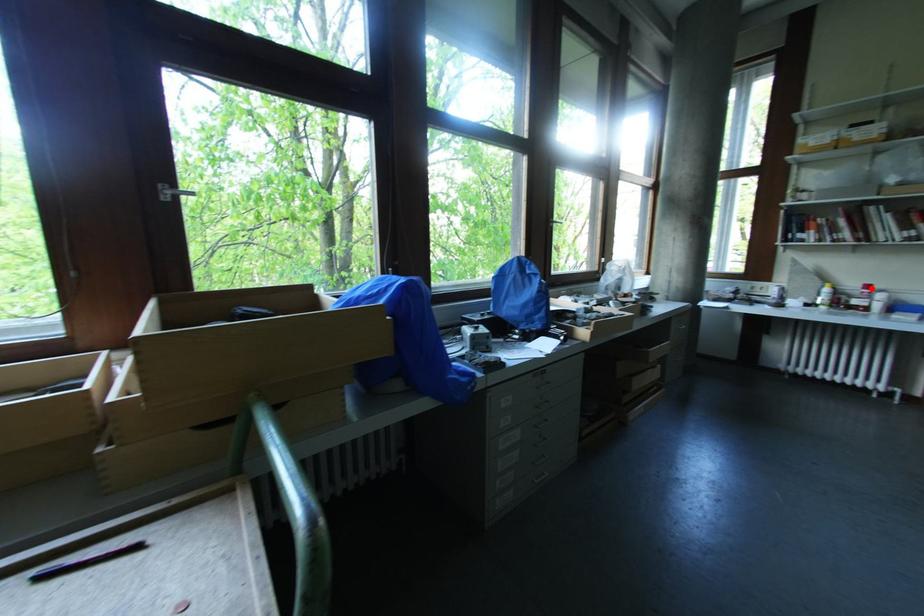
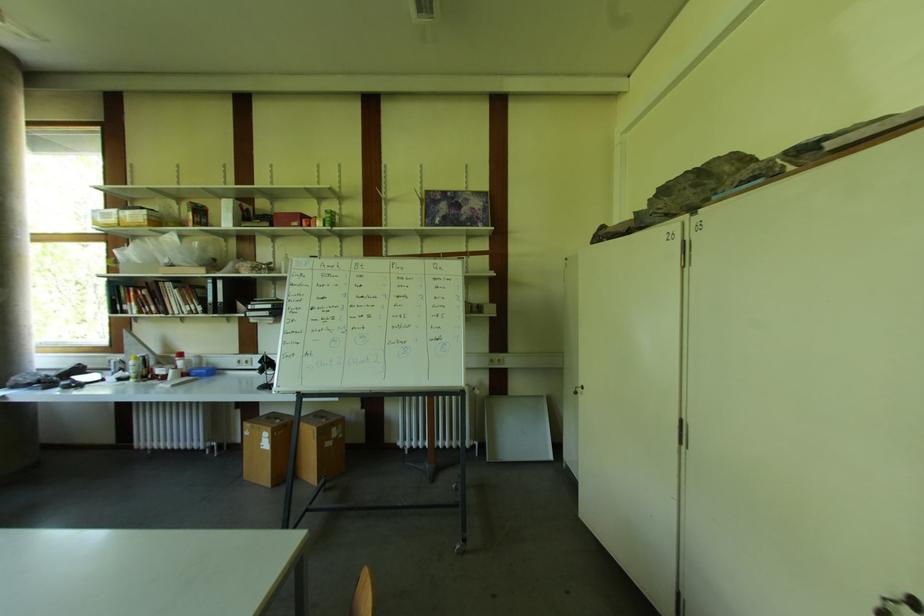
Find the pixel in the second image that matches the highlighted location in the first image.

(184, 357)